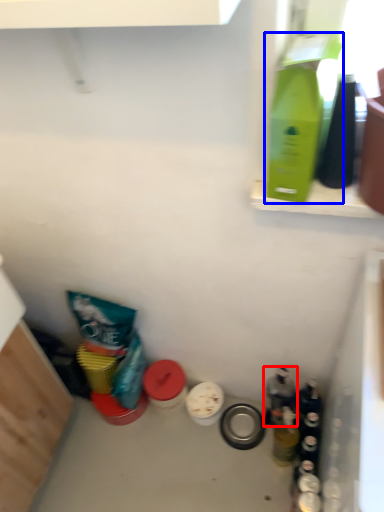
Question: Which point is closer to the camera, bottle (highlighted by a red box) or bottle (highlighted by a blue box)?

Choices:
 (A) bottle
 (B) bottle

Answer: (B)